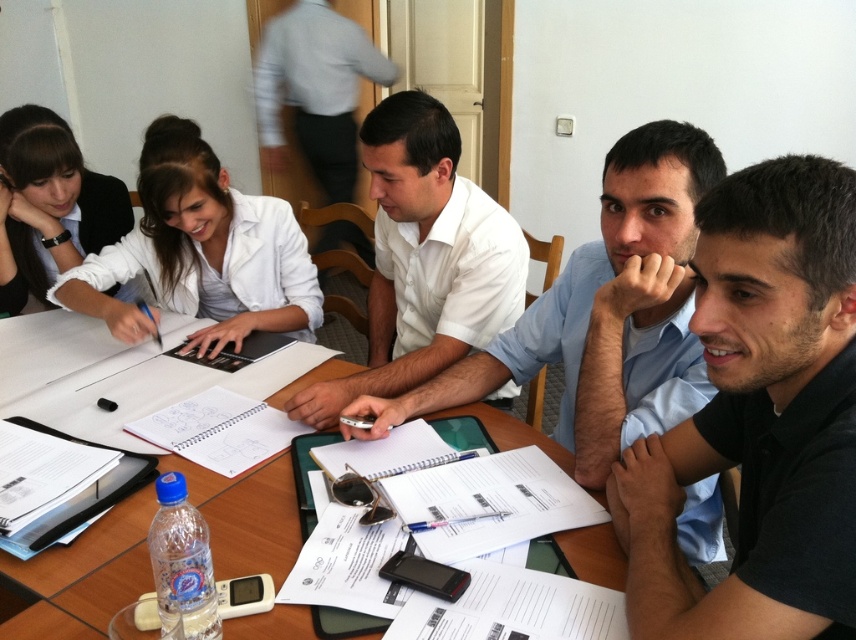
Question: Which point is farther from the camera taking this photo?

Choices:
 (A) (348, 129)
 (B) (379, 340)
 (C) (704, 170)

Answer: (A)

Question: Does white matte jacket at upper left come behind white shirt at upper center?

Choices:
 (A) yes
 (B) no

Answer: (B)

Question: Among these points, which one is farthest from the camera?

Choices:
 (A) (697, 173)
 (B) (248, 259)

Answer: (B)

Question: Is black matte shirt at center closer to the viewer compared to wooden table at center?

Choices:
 (A) yes
 (B) no

Answer: (A)

Question: Can you confirm if light blue shirt at center is positioned above white matte jacket at upper left?

Choices:
 (A) yes
 (B) no

Answer: (B)

Question: Which of these objects is positioned farthest from the black matte shirt at center?

Choices:
 (A) white matte jacket at upper left
 (B) white shirt at upper center

Answer: (B)